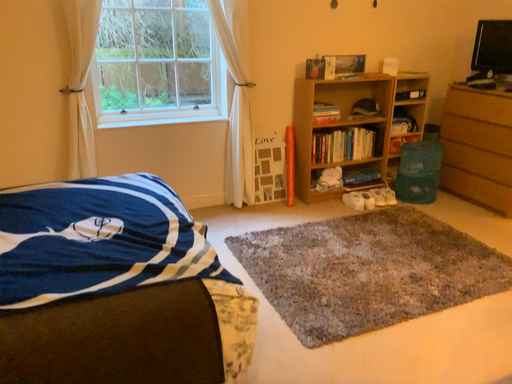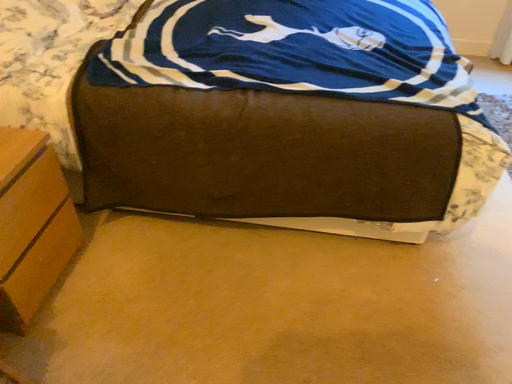
Question: How did the camera likely rotate when shooting the video?

Choices:
 (A) rotated left
 (B) rotated right

Answer: (A)